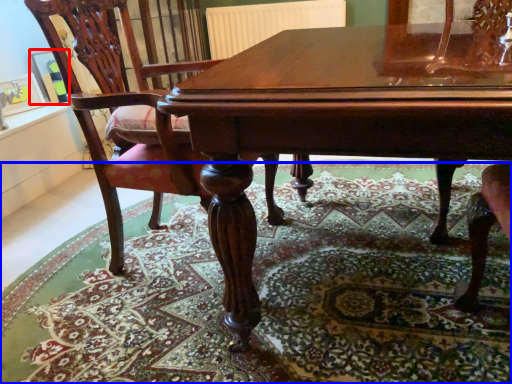
Question: Which point is further to the camera, picture frame (highlighted by a red box) or mat (highlighted by a blue box)?

Choices:
 (A) picture frame
 (B) mat

Answer: (A)